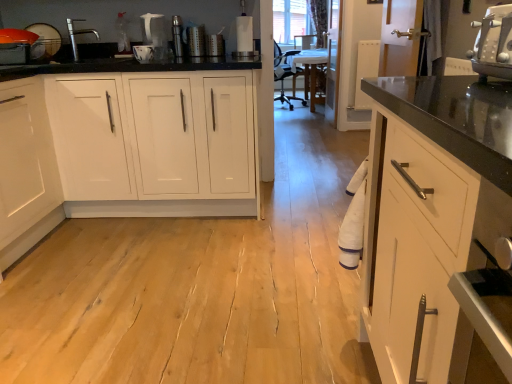
Locate an element on the screen. The image size is (512, 384). vacant region under satin nickel faucet at upper left (from a real-world perspective) is located at coordinates (88, 54).